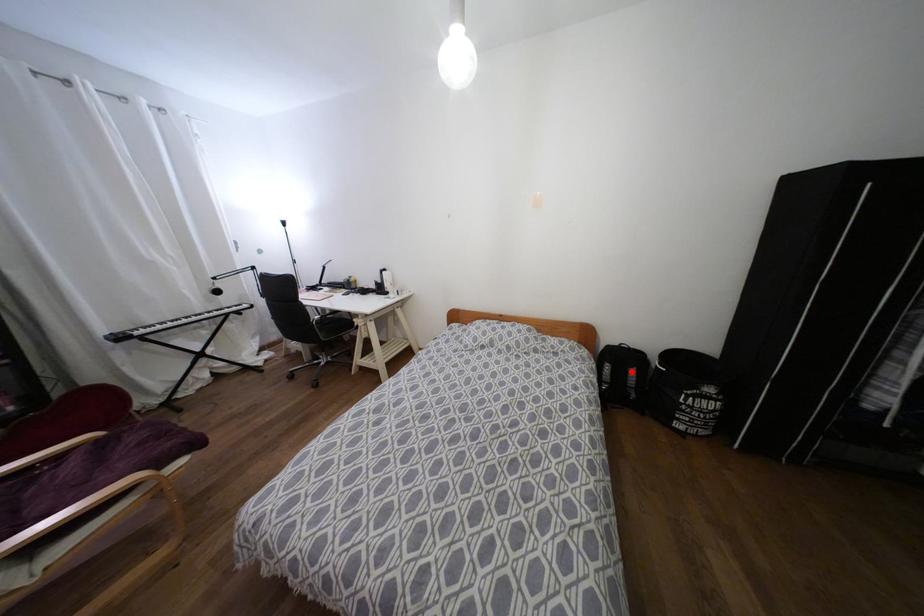
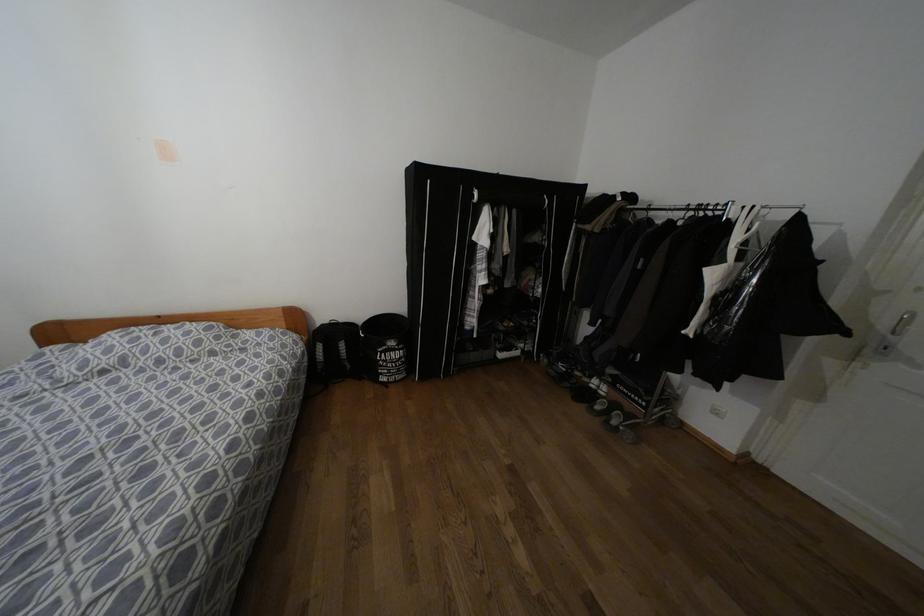
Find the pixel in the second image that matches the highlighted location in the first image.

(342, 345)